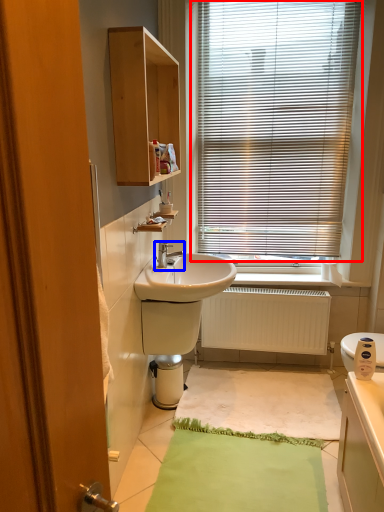
Question: Which of the following is the farthest to the observer, window blind (highlighted by a red box) or tap (highlighted by a blue box)?

Choices:
 (A) window blind
 (B) tap

Answer: (A)